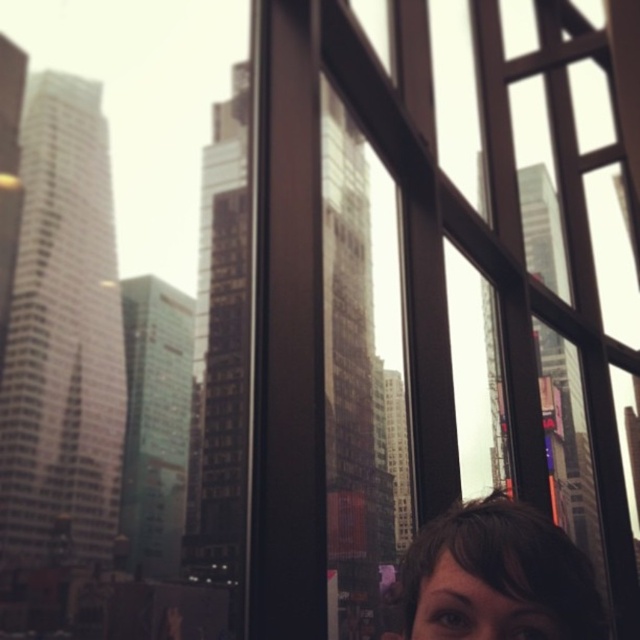
You are taking a selfie through the transparent glass window at center and notice the brown hair at lower right in your frame. Which object is closer to the right edge of the window?

The transparent glass window at center is positioned on the right side of brown hair at lower right, so the transparent glass window at center is closer to the right edge of the window.

You are standing inside a building looking at the city through the window. You notice a point at coordinates (413, 280). Is this point part of the transparent glass window at center?

Yes, the transparent glass window at center is located at point (413, 280), so the point is part of the window.

You are taking a selfie through the window and want to ensure both the transparent glass window at center and the brown hair at lower right are in the frame. Which object should you position closer to the camera to achieve this?

To ensure both the transparent glass window at center and the brown hair at lower right are in the frame, you should position the brown hair at lower right closer to the camera since the transparent glass window at center is already positioned over it, meaning it is further away.